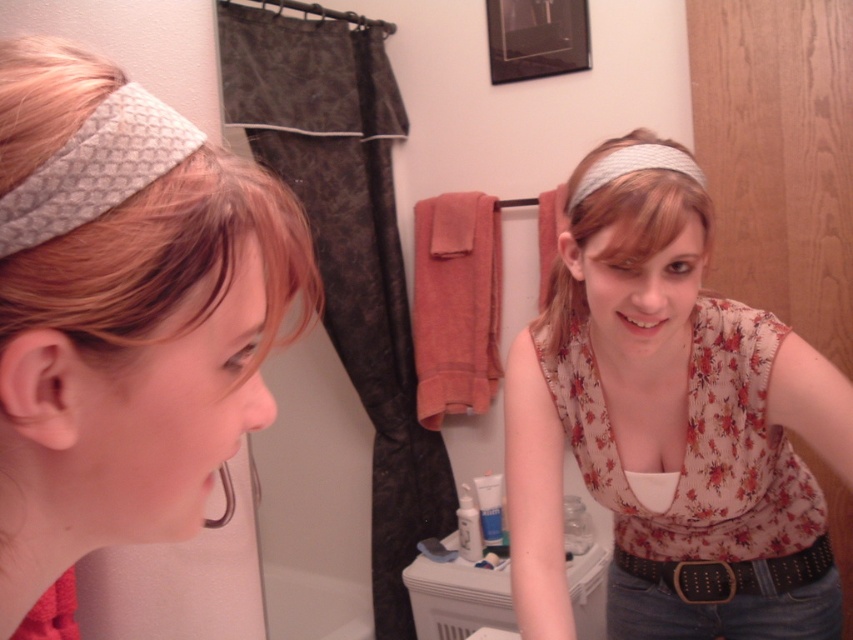
You are standing in a bathroom and see the floral fabric top at center. If you want to reach it from where you are standing, will you need to stretch your arm forward or can you reach it without stretching?

The floral fabric top at center is 77.12 centimeters from the viewer, so you can reach it without stretching your arm forward.

You are a photographer standing 3 feet away from the white textured headband at center. Can you reach it without moving your feet?

The white textured headband at center is 30.08 inches away from the camera. Since 3 feet equals 36 inches, the distance from you to the headband is 36 inches minus 30.08 inches, which is approximately 5.92 inches. Therefore, you can easily reach it without moving your feet.